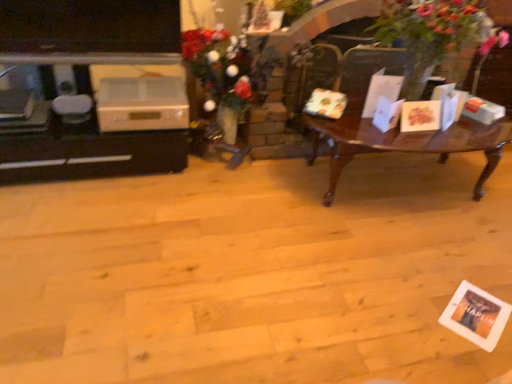
Where is `free location in front of white glossy entertainment center at left`? Image resolution: width=512 pixels, height=384 pixels. free location in front of white glossy entertainment center at left is located at coordinates (76, 235).